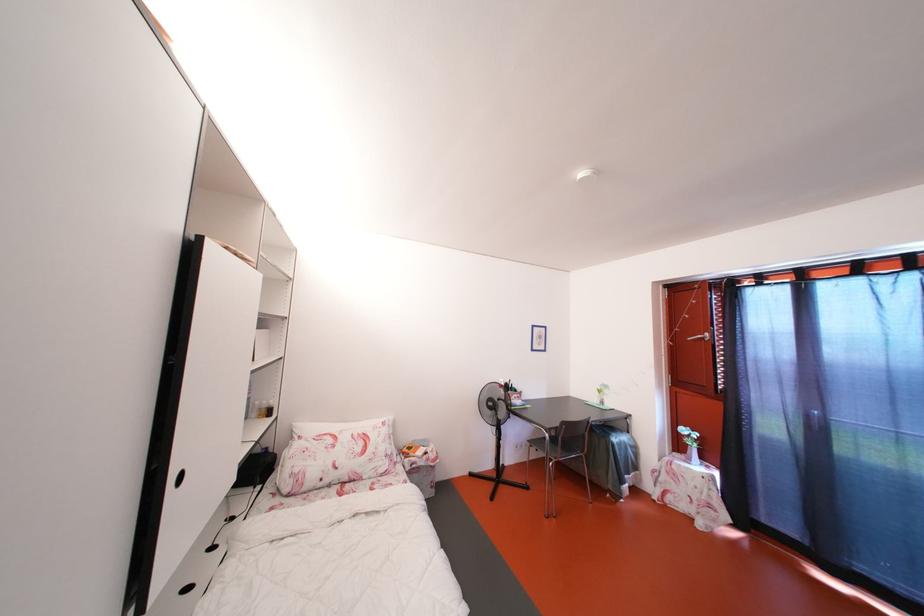
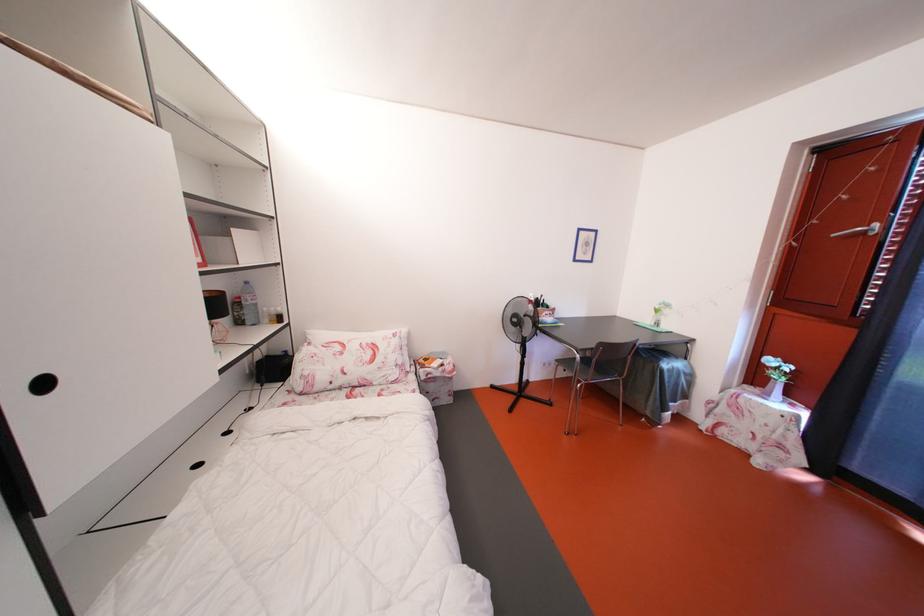
Find the pixel in the second image that matches [429,469] in the first image.

(444, 379)